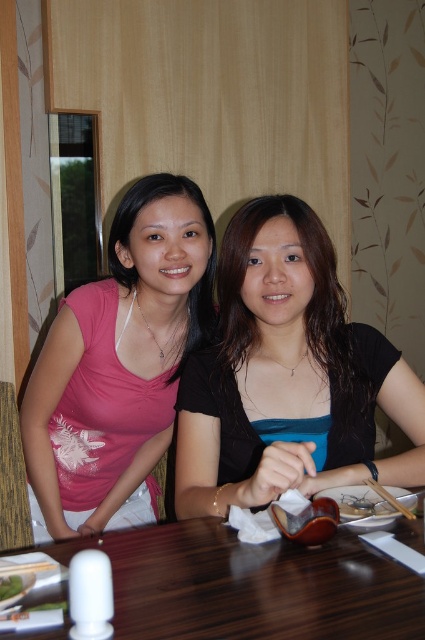
You are a tailor who needs to determine if the matte pink shirt at left can be folded and placed into the wooden chopsticks at table right. Based on the size comparison between them, what is your assessment?

The matte pink shirt at left has a larger size compared to wooden chopsticks at table right, so it cannot be folded and placed into the wooden chopsticks at table right due to its larger size.

What are the coordinates of the matte black shirt at center?

The coordinates of the matte black shirt at center are at point (286, 372).